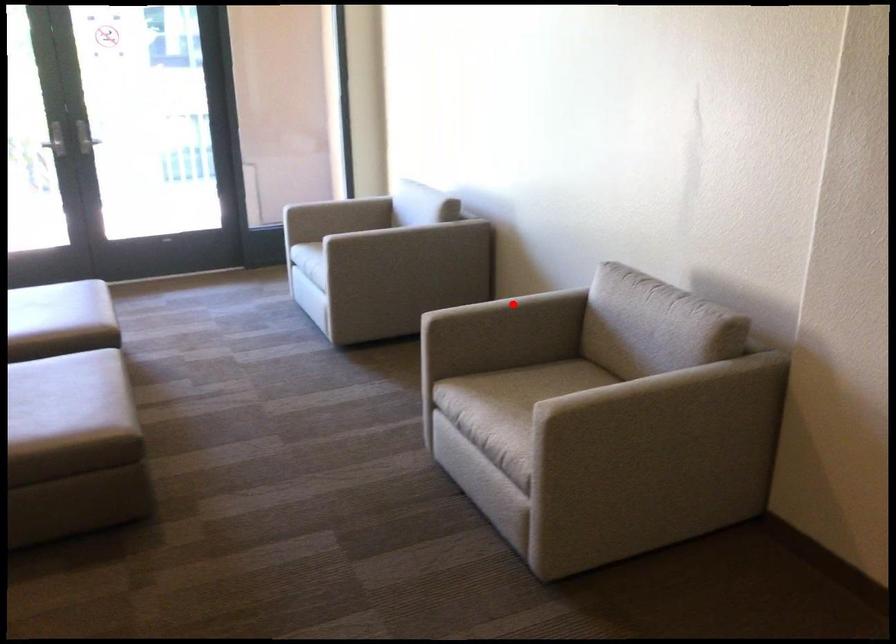
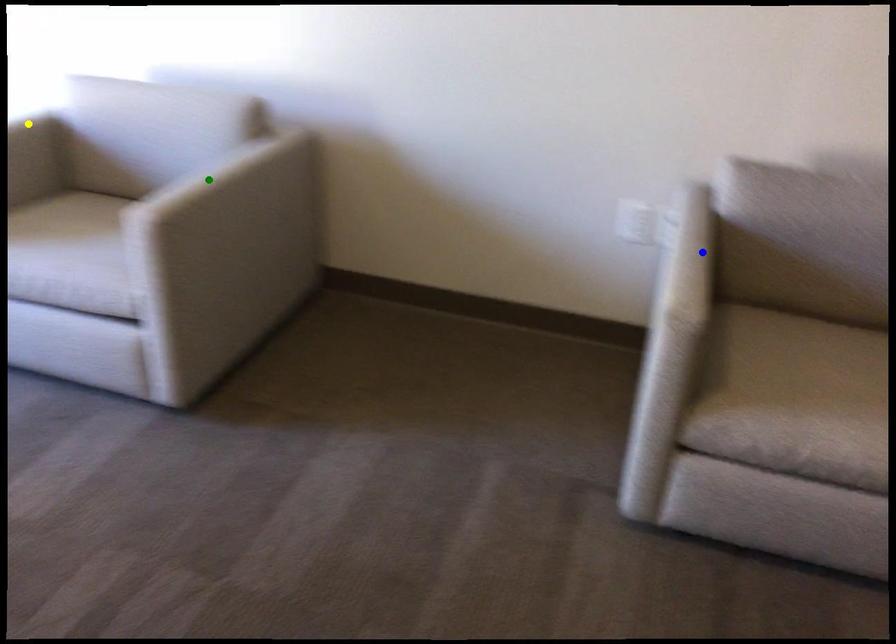
Question: I am providing you with two images of the same scene from different viewpoints. A red point is marked on the first image. You are given multiple points on the second image. Which point in image 2 is actually the same real-world point as the red point in image 1?

Choices:
 (A) green point
 (B) blue point
 (C) yellow point

Answer: (B)